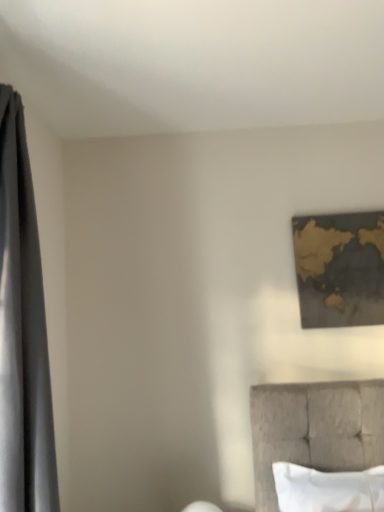
Question: Is gold metallic map at upper right turned away from silky gray curtain at left?

Choices:
 (A) yes
 (B) no

Answer: (B)

Question: Is gold metallic map at upper right outside silky gray curtain at left?

Choices:
 (A) no
 (B) yes

Answer: (B)

Question: Is gold metallic map at upper right far from silky gray curtain at left?

Choices:
 (A) no
 (B) yes

Answer: (B)

Question: Can you confirm if gold metallic map at upper right is wider than silky gray curtain at left?

Choices:
 (A) no
 (B) yes

Answer: (A)

Question: Does gold metallic map at upper right have a lesser height compared to silky gray curtain at left?

Choices:
 (A) no
 (B) yes

Answer: (B)

Question: Which is correct: white soft pillow at lower right is inside silky gray curtain at left, or outside of it?

Choices:
 (A) outside
 (B) inside

Answer: (A)

Question: In terms of width, does white soft pillow at lower right look wider or thinner when compared to silky gray curtain at left?

Choices:
 (A) wide
 (B) thin

Answer: (B)

Question: Relative to silky gray curtain at left, is white soft pillow at lower right in front or behind?

Choices:
 (A) behind
 (B) front

Answer: (A)

Question: Looking at the image, does white soft pillow at lower right seem bigger or smaller compared to silky gray curtain at left?

Choices:
 (A) small
 (B) big

Answer: (A)

Question: From the image's perspective, is white soft pillow at lower right located above or below gold metallic map at upper right?

Choices:
 (A) below
 (B) above

Answer: (A)

Question: Looking at the image, does white soft pillow at lower right seem bigger or smaller compared to gold metallic map at upper right?

Choices:
 (A) big
 (B) small

Answer: (A)

Question: Is white soft pillow at lower right in front of or behind gold metallic map at upper right in the image?

Choices:
 (A) front
 (B) behind

Answer: (A)

Question: In terms of width, does white soft pillow at lower right look wider or thinner when compared to gold metallic map at upper right?

Choices:
 (A) thin
 (B) wide

Answer: (B)

Question: From a real-world perspective, is silky gray curtain at left positioned above or below white soft pillow at lower right?

Choices:
 (A) above
 (B) below

Answer: (A)

Question: Is point (29, 317) closer or farther from the camera than point (375, 485)?

Choices:
 (A) closer
 (B) farther

Answer: (A)